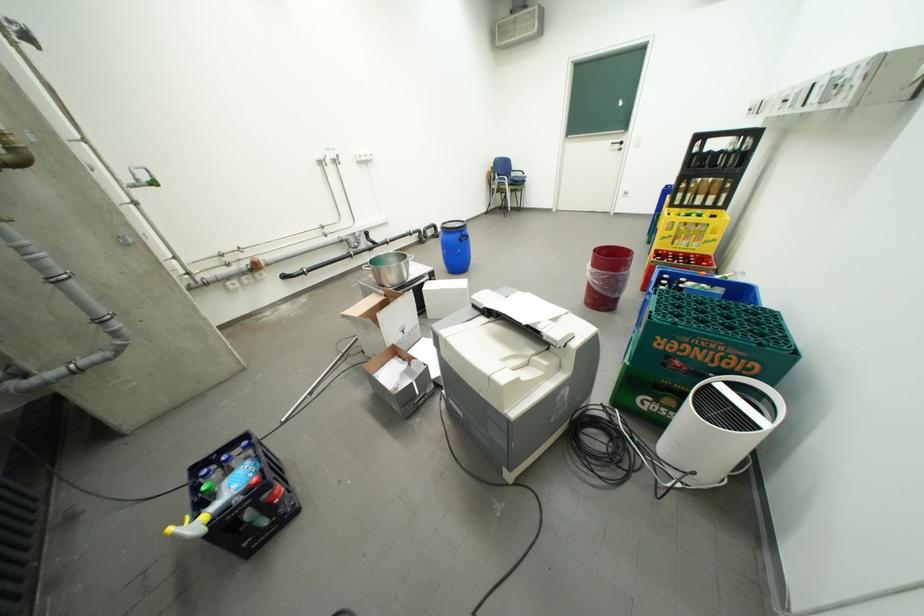
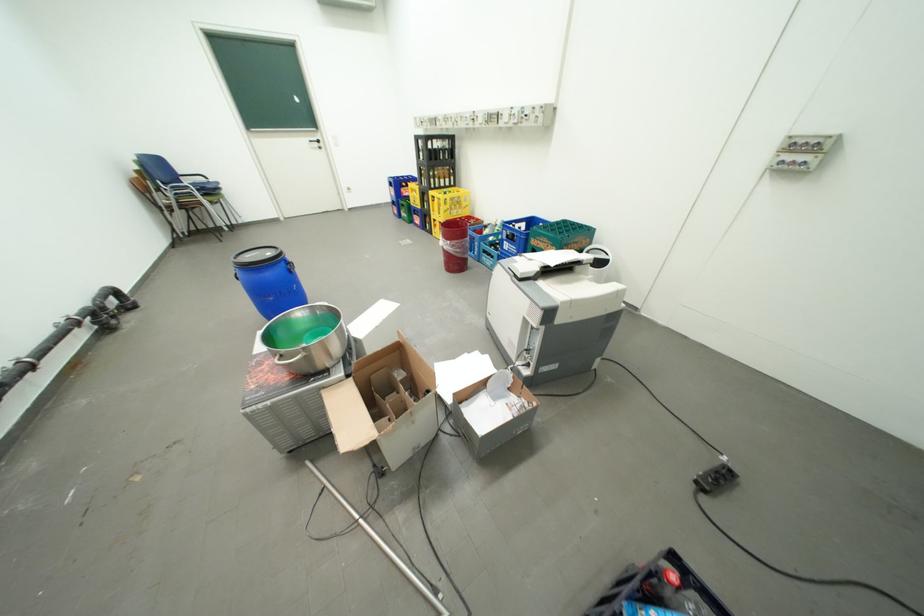
Locate, in the second image, the point that corresponds to [602,269] in the first image.

(459, 243)